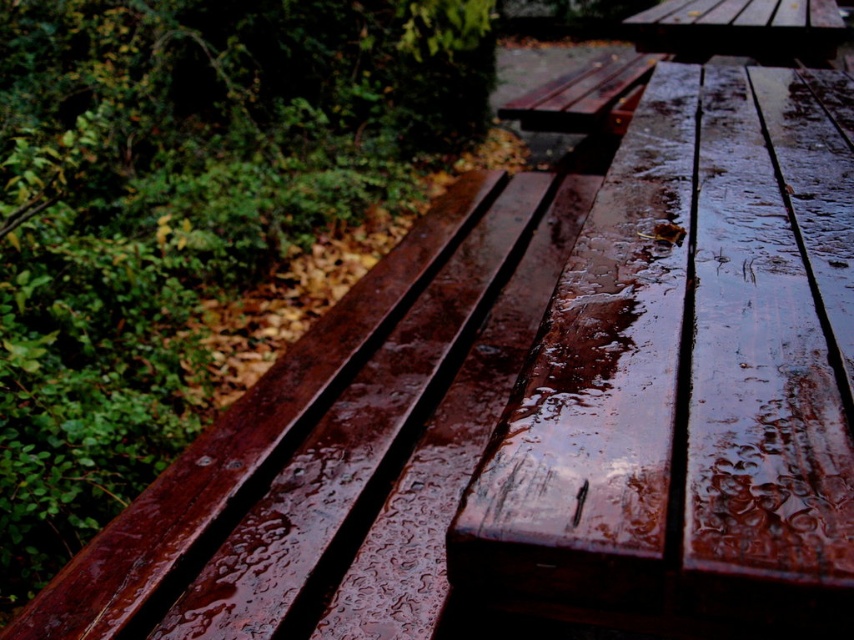
How far apart are glossy wood bench at left and wet wood plank at center?

glossy wood bench at left and wet wood plank at center are 1.83 meters apart.

Who is more distant from viewer, (44, 186) or (303, 516)?

Point (44, 186)

Locate an element on the screen. The height and width of the screenshot is (640, 854). glossy wood bench at left is located at coordinates (180, 209).

Can you confirm if wet wood plank at center is positioned to the right of wet wood picnic table at upper center?

In fact, wet wood plank at center is to the left of wet wood picnic table at upper center.

Who is more forward, (x=431, y=278) or (x=721, y=49)?

Positioned in front is point (x=431, y=278).

Locate an element on the screen. The width and height of the screenshot is (854, 640). wet wood plank at center is located at coordinates (346, 444).

Is glossy wood bench at left shorter than wet wood picnic table at upper center?

No, glossy wood bench at left is not shorter than wet wood picnic table at upper center.

Does point (147, 48) come behind point (782, 48)?

Yes, point (147, 48) is farther from viewer.

I want to click on glossy wood bench at left, so click(x=180, y=209).